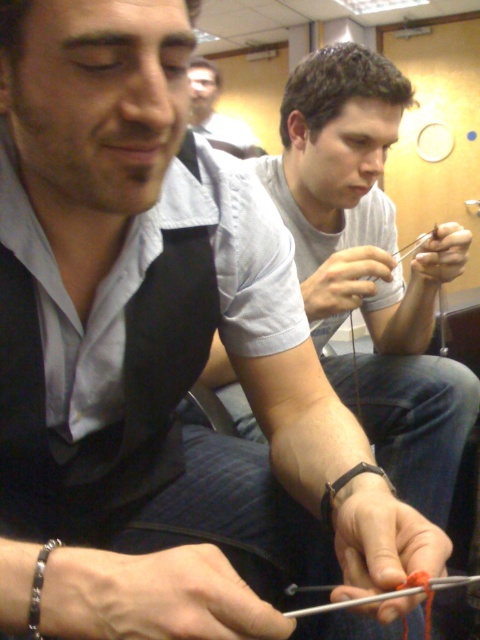
Question: In this image, where is gray matte shirt at center located relative to gray striped shirt at upper center?

Choices:
 (A) right
 (B) left

Answer: (A)

Question: Can you confirm if gray matte shirt at center is positioned to the left of gray striped shirt at upper center?

Choices:
 (A) no
 (B) yes

Answer: (A)

Question: Can you confirm if gray matte shirt at center is bigger than gray striped shirt at upper center?

Choices:
 (A) no
 (B) yes

Answer: (A)

Question: Which object is closer to the camera taking this photo?

Choices:
 (A) gray striped shirt at upper center
 (B) gray matte shirt at center

Answer: (B)

Question: Which point is closer to the camera?

Choices:
 (A) gray striped shirt at upper center
 (B) gray matte shirt at center

Answer: (B)

Question: Which point appears farthest from the camera in this image?

Choices:
 (A) (196, 122)
 (B) (415, 276)

Answer: (A)